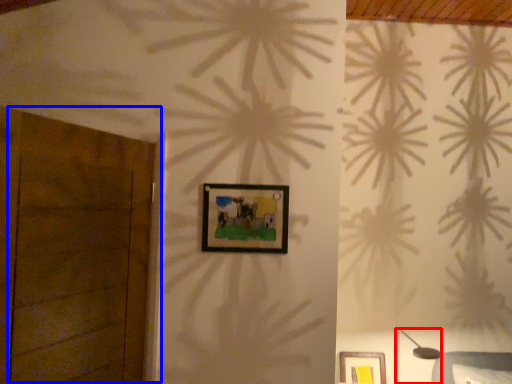
Question: Which of the following is the farthest to the observer, table lamp (highlighted by a red box) or door (highlighted by a blue box)?

Choices:
 (A) table lamp
 (B) door

Answer: (A)